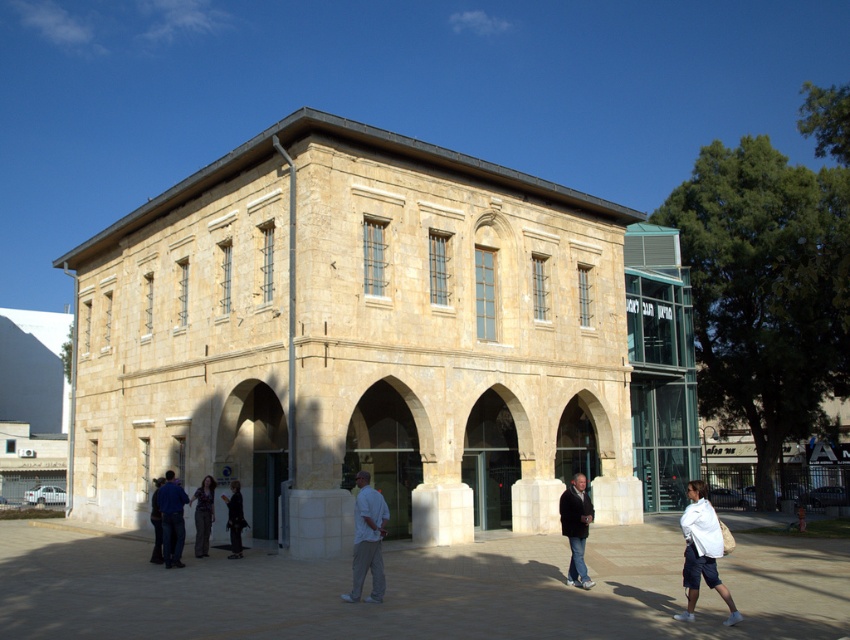
You are standing in front of the two story building and want to walk through the entrance. Which object, the beige stone archway at center or the dark blue jeans at center, is wider and thus more suitable for carrying a large box?

Result: The beige stone archway at center is wider than the dark blue jeans at center, so the beige stone archway at center is more suitable for carrying a large box.

You are standing in front of the two story building and want to determine the relative positions of two points marked on the building. Which point is closer to you, point (686, 589) or point (159, 481)?

Point (686, 589) is closer to the camera than point (159, 481).